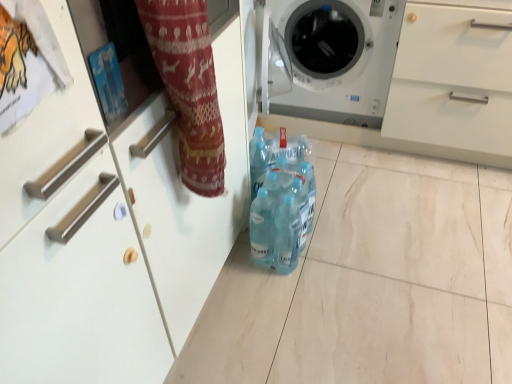
Question: In terms of height, does white glossy washing machine at center look taller or shorter compared to blue plastic bottles at center?

Choices:
 (A) short
 (B) tall

Answer: (B)

Question: From a real-world perspective, is white glossy washing machine at center above or below blue plastic bottles at center?

Choices:
 (A) below
 (B) above

Answer: (B)

Question: In the image, is white glossy washing machine at center on the left side or the right side of blue plastic bottles at center?

Choices:
 (A) left
 (B) right

Answer: (B)

Question: Considering the positions of point pyautogui.click(x=266, y=213) and point pyautogui.click(x=295, y=96), is point pyautogui.click(x=266, y=213) closer or farther from the camera than point pyautogui.click(x=295, y=96)?

Choices:
 (A) closer
 (B) farther

Answer: (A)

Question: Is blue plastic bottles at center in front of or behind white glossy washing machine at center in the image?

Choices:
 (A) behind
 (B) front

Answer: (B)

Question: From a real-world perspective, is blue plastic bottles at center physically located above or below white glossy washing machine at center?

Choices:
 (A) above
 (B) below

Answer: (B)

Question: From the image's perspective, is blue plastic bottles at center located above or below white glossy washing machine at center?

Choices:
 (A) below
 (B) above

Answer: (A)